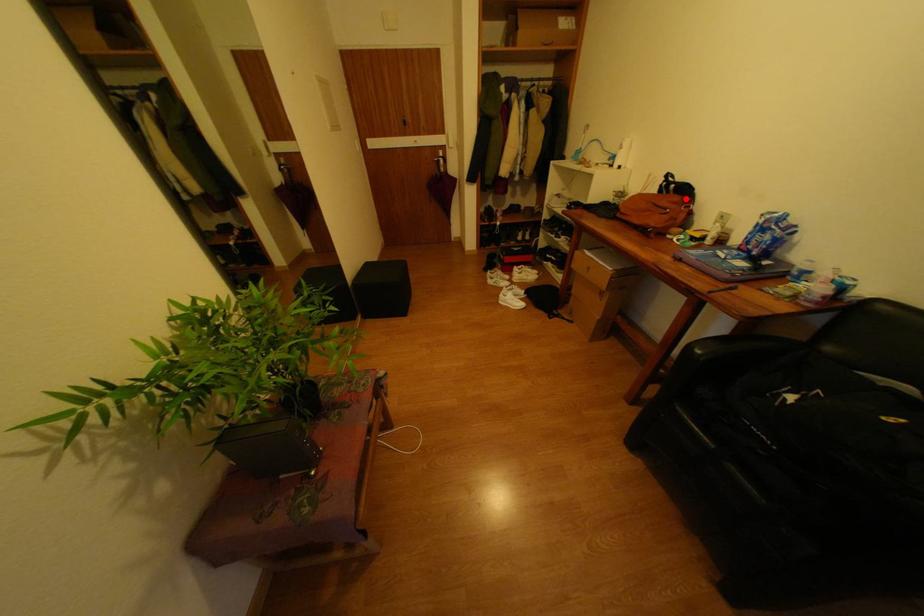
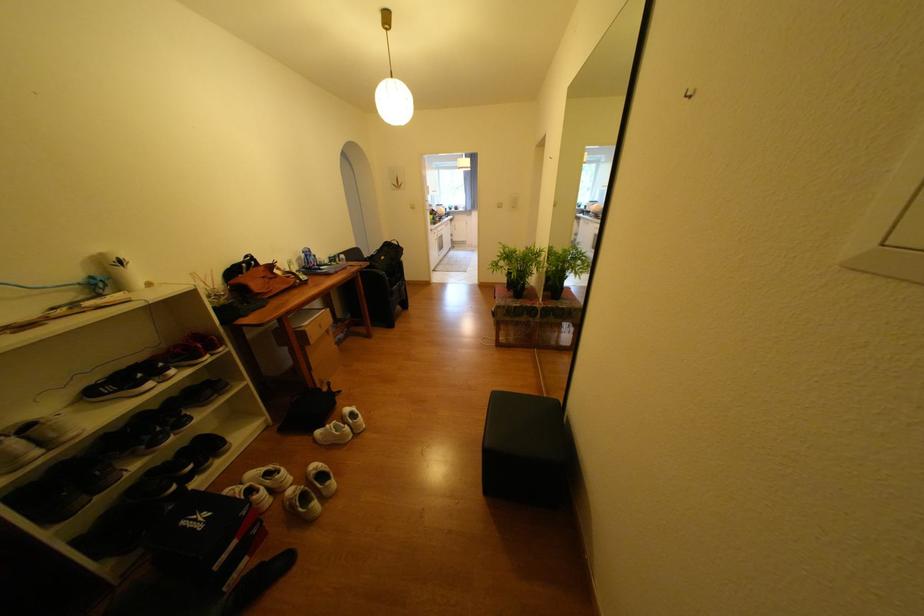
Find the pixel in the second image that matches the highlighted location in the first image.

(271, 269)